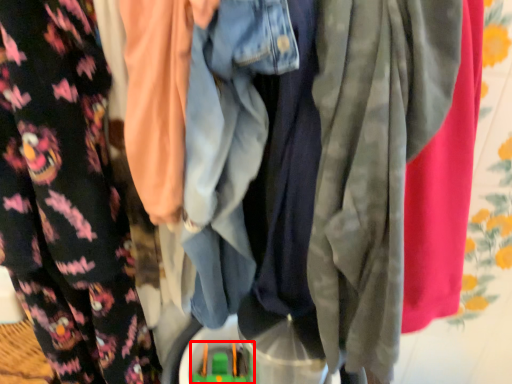
Question: Observing the image, what is the correct spatial positioning of toy (annotated by the red box) in reference to fancy dress?

Choices:
 (A) left
 (B) right

Answer: (B)